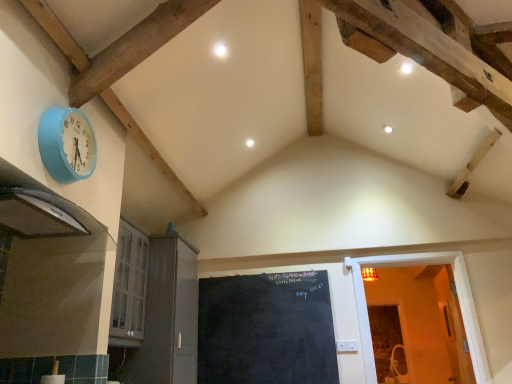
Question: Is point (62, 127) positioned closer to the camera than point (179, 375)?

Choices:
 (A) farther
 (B) closer

Answer: (B)

Question: From the image's perspective, is blue fabric wall clock at upper left located above or below white glossy cabinet at lower left, positioned as the first door in left-to-right order?

Choices:
 (A) above
 (B) below

Answer: (A)

Question: Which is farther from the black glossy exhaust hood at left?

Choices:
 (A) black chalkboard at center
 (B) white glossy cabinet at lower left, positioned as the first door in left-to-right order
 (C) blue fabric wall clock at upper left
 (D) wooden door at right, arranged as the first door when viewed from the right

Answer: (D)

Question: Which of these objects is positioned farthest from the wooden door at right, arranged as the first door when viewed from the right?

Choices:
 (A) black glossy exhaust hood at left
 (B) white glossy cabinet at lower left, placed as the second door when sorted from right to left
 (C) blue fabric wall clock at upper left
 (D) black chalkboard at center

Answer: (C)